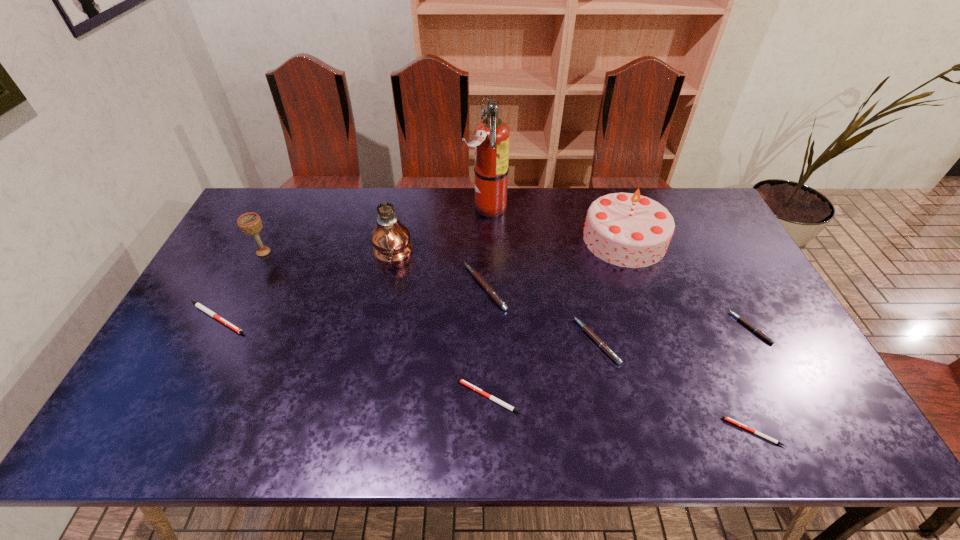
At what (x,y) coordinates should I click in order to perform the action: click on vacant region located 0.140m from the nozzle of the fire extinguisher. Please return your answer as a coordinate pair (x, y). This screenshot has width=960, height=540. Looking at the image, I should click on (425, 207).

Where is `blank area located from the nozzle of the fire extinguisher`? The height and width of the screenshot is (540, 960). blank area located from the nozzle of the fire extinguisher is located at coordinates (450, 207).

Locate an element on the screen. The image size is (960, 540). vacant region located on the front of the oil lamp is located at coordinates (367, 379).

At what (x,y) coordinates should I click in order to perform the action: click on free region located 0.090m on the right of the eighth shortest object. Please return your answer as a coordinate pair (x, y). The image size is (960, 540). Looking at the image, I should click on (693, 239).

Identify the location of vacant space situated 0.180m on the front of the seventh shortest object. (238, 302).

Where is `vacant position located at the nib of the leftmost pink pen`? vacant position located at the nib of the leftmost pink pen is located at coordinates (362, 287).

Identify the location of vacant space located 0.340m at the nib of the leftmost pink pen. (348, 287).

Locate an element on the screen. The image size is (960, 540). free space located 0.230m at the nib of the leftmost pink pen is located at coordinates (386, 287).

Where is `free space located at the nib of the second pink pen from right to left`? Image resolution: width=960 pixels, height=540 pixels. free space located at the nib of the second pink pen from right to left is located at coordinates (426, 341).

Identify the location of free space located at the nib of the second pink pen from right to left. The image size is (960, 540). (491, 341).